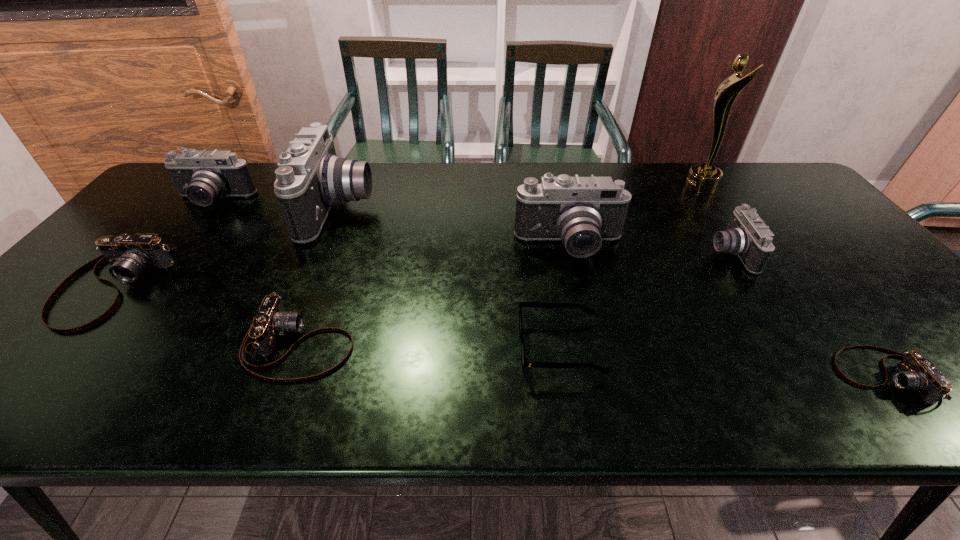
Locate an element on the screen. vacant space situated 0.240m on the front-facing side of the rightmost brown camera is located at coordinates (723, 376).

The width and height of the screenshot is (960, 540). What are the coordinates of `free spot located 0.310m on the front-facing side of the rightmost brown camera` in the screenshot? It's located at (688, 376).

I want to click on free space located on the front-facing side of the rightmost brown camera, so click(x=767, y=376).

At what (x,y) coordinates should I click in order to perform the action: click on award that is at the far edge. Please return your answer as a coordinate pair (x, y). The height and width of the screenshot is (540, 960). Looking at the image, I should click on (702, 178).

Identify the location of spectacles positioned at the near edge. The width and height of the screenshot is (960, 540). (589, 311).

Find the location of a particular element. The image size is (960, 540). object that is at the right edge is located at coordinates (915, 372).

What are the coordinates of `object present at the far left corner` in the screenshot? It's located at (203, 176).

The width and height of the screenshot is (960, 540). What are the coordinates of `object located at the near right corner` in the screenshot? It's located at (915, 372).

Where is `free space at the far edge of the desktop`? free space at the far edge of the desktop is located at coordinates (x=659, y=166).

In the image, there is a desktop. Where is `vacant space at the near edge`? vacant space at the near edge is located at coordinates (908, 395).